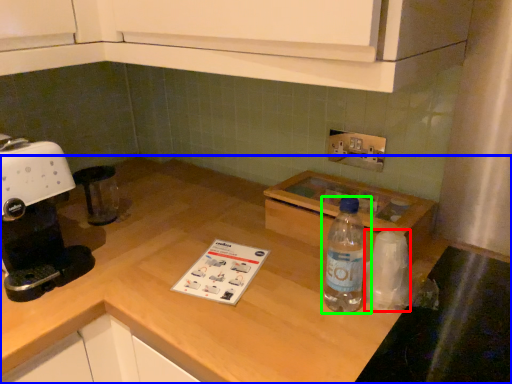
Question: Estimate the real-world distances between objects in this image. Which object is closer to paper towel (highlighted by a red box), countertop (highlighted by a blue box) or bottle (highlighted by a green box)?

Choices:
 (A) countertop
 (B) bottle

Answer: (B)